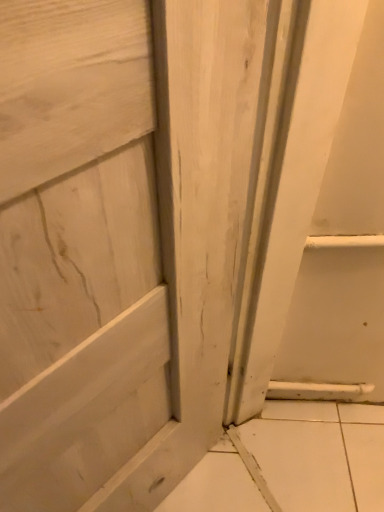
You are a GUI agent. You are given a task and a screenshot of the screen. Output one action in this format:
    pyautogui.click(x=<x>, y=<y>)
    Task: Click on the white wood screen door at center
    
    Given the screenshot: What is the action you would take?
    pyautogui.click(x=78, y=253)

The image size is (384, 512). Describe the element at coordinates (78, 253) in the screenshot. I see `white wood screen door at center` at that location.

At what (x,y) coordinates should I click in order to perform the action: click on white wood screen door at center. Please return your answer as a coordinate pair (x, y). The height and width of the screenshot is (512, 384). Looking at the image, I should click on (78, 253).